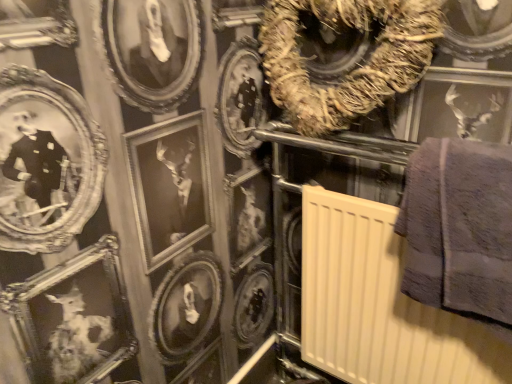
Question: Would you say brown textured wreath at upper center is outside beige plastic radiator at center-right?

Choices:
 (A) no
 (B) yes

Answer: (B)

Question: From a real-world perspective, is brown textured wreath at upper center below beige plastic radiator at center-right?

Choices:
 (A) yes
 (B) no

Answer: (B)

Question: Does brown textured wreath at upper center have a smaller size compared to beige plastic radiator at center-right?

Choices:
 (A) no
 (B) yes

Answer: (B)

Question: Is brown textured wreath at upper center facing away from beige plastic radiator at center-right?

Choices:
 (A) yes
 (B) no

Answer: (B)

Question: Considering the relative positions of brown textured wreath at upper center and beige plastic radiator at center-right in the image provided, is brown textured wreath at upper center in front of beige plastic radiator at center-right?

Choices:
 (A) no
 (B) yes

Answer: (A)

Question: Based on their positions, is brown textured wreath at upper center located to the left or right of gray fluffy towel at right?

Choices:
 (A) right
 (B) left

Answer: (B)

Question: Is brown textured wreath at upper center taller or shorter than gray fluffy towel at right?

Choices:
 (A) tall
 (B) short

Answer: (B)

Question: In terms of size, does brown textured wreath at upper center appear bigger or smaller than gray fluffy towel at right?

Choices:
 (A) small
 (B) big

Answer: (B)

Question: Is brown textured wreath at upper center inside or outside of gray fluffy towel at right?

Choices:
 (A) inside
 (B) outside

Answer: (B)

Question: Considering the positions of point click(x=356, y=375) and point click(x=331, y=105), is point click(x=356, y=375) closer or farther from the camera than point click(x=331, y=105)?

Choices:
 (A) farther
 (B) closer

Answer: (A)

Question: In terms of width, does beige plastic radiator at center-right look wider or thinner when compared to brown textured wreath at upper center?

Choices:
 (A) wide
 (B) thin

Answer: (A)

Question: Do you think beige plastic radiator at center-right is within brown textured wreath at upper center, or outside of it?

Choices:
 (A) outside
 (B) inside

Answer: (A)

Question: Considering their positions, is beige plastic radiator at center-right located in front of or behind brown textured wreath at upper center?

Choices:
 (A) front
 (B) behind

Answer: (A)

Question: Looking at their shapes, would you say beige plastic radiator at center-right is wider or thinner than gray fluffy towel at right?

Choices:
 (A) wide
 (B) thin

Answer: (A)

Question: From a real-world perspective, is beige plastic radiator at center-right positioned above or below gray fluffy towel at right?

Choices:
 (A) above
 (B) below

Answer: (B)